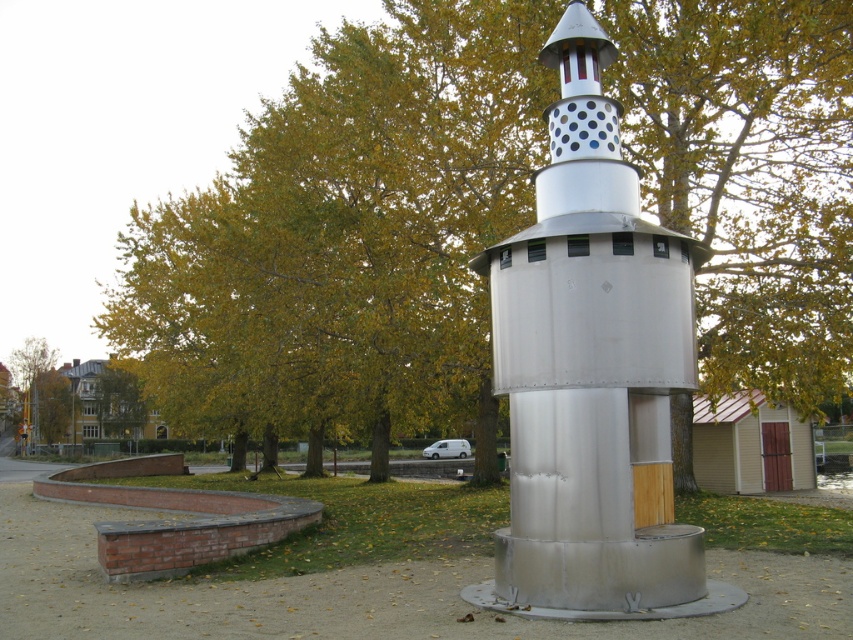
You are a bird looking for a place to perch. You can choose between the metallic silver tower at center and the green leafy tree at upper left. Which option is taller?

The metallic silver tower at center is much taller than the green leafy tree at upper left, so the tower is the taller option for perching.

Looking at this image, you are standing in the park and see the green leafy tree at center and the metallic silver tower at center. Which object is closer to you?

The green leafy tree at center is closer to you because the metallic silver tower at center is behind it.